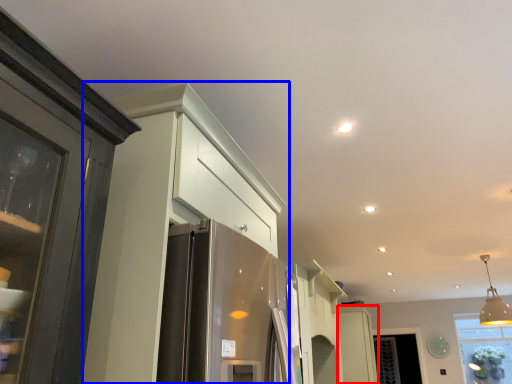
Question: Which object appears farthest to the camera in this image, cabinetry (highlighted by a red box) or cabinetry (highlighted by a blue box)?

Choices:
 (A) cabinetry
 (B) cabinetry

Answer: (A)